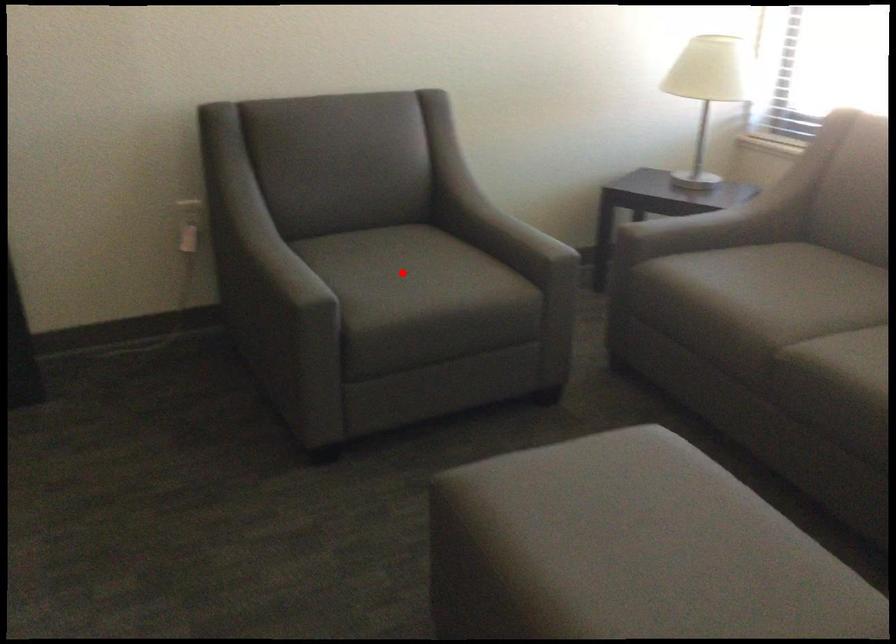
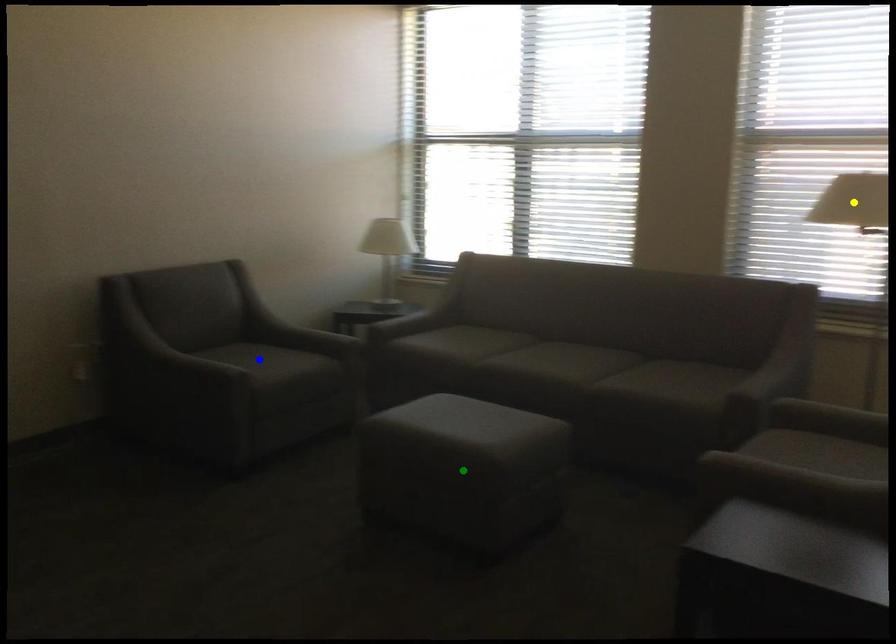
Question: I am providing you with two images of the same scene from different viewpoints. A red point is marked on the first image. You are given multiple points on the second image. Which point in image 2 is actually the same real-world point as the red point in image 1?

Choices:
 (A) yellow point
 (B) blue point
 (C) green point

Answer: (B)